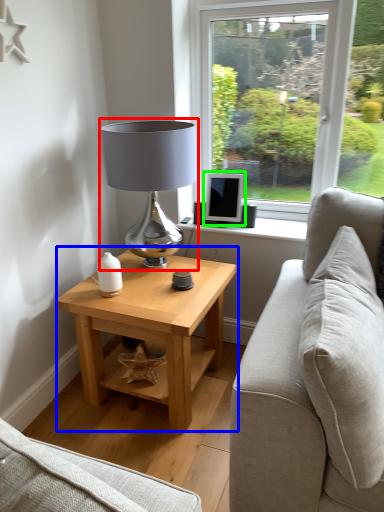
Question: Which object is positioned closest to table lamp (highlighted by a red box)? Select from table (highlighted by a blue box) and computer monitor (highlighted by a green box).

Choices:
 (A) table
 (B) computer monitor

Answer: (B)